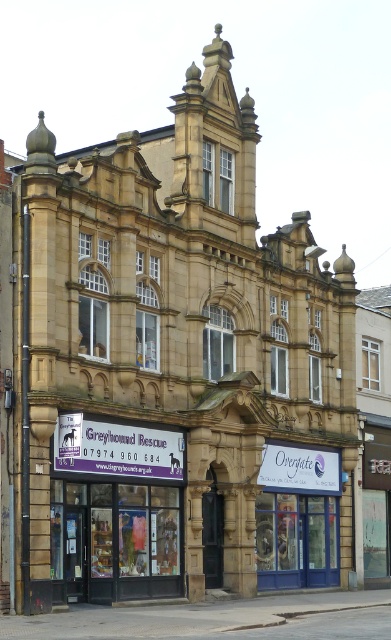
Question: Can you confirm if purple fabric sign at lower center is positioned to the right of white plastic sign at center?

Choices:
 (A) no
 (B) yes

Answer: (A)

Question: Which point is farther to the camera?

Choices:
 (A) (270, 451)
 (B) (80, 449)

Answer: (A)

Question: Does purple fabric sign at lower center appear over white plastic sign at center?

Choices:
 (A) no
 (B) yes

Answer: (B)

Question: Can you confirm if purple fabric sign at lower center is positioned to the right of white plastic sign at center?

Choices:
 (A) yes
 (B) no

Answer: (B)

Question: Which point is farther to the camera?

Choices:
 (A) purple fabric sign at lower center
 (B) white plastic sign at center

Answer: (B)

Question: Which object is closer to the camera taking this photo?

Choices:
 (A) white plastic sign at center
 (B) purple fabric sign at lower center

Answer: (B)